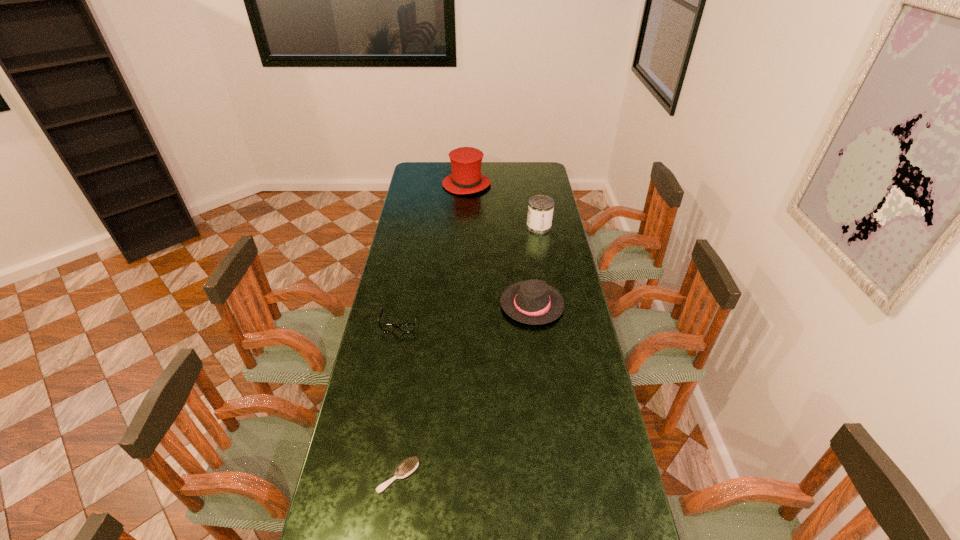
At what (x,y) coordinates should I click in order to perform the action: click on empty location between the nearer dress hat and the fourth nearest object. Please return your answer as a coordinate pair (x, y). Image resolution: width=960 pixels, height=540 pixels. Looking at the image, I should click on (536, 266).

Image resolution: width=960 pixels, height=540 pixels. What are the coordinates of `free space that is in between the shorter dress hat and the second farthest object` in the screenshot? It's located at (x=536, y=266).

Locate an element on the screen. The height and width of the screenshot is (540, 960). blank region between the tallest object and the right dress hat is located at coordinates (499, 245).

The height and width of the screenshot is (540, 960). Identify the location of vacant space in between the fourth tallest object and the shortest object. (399, 399).

The height and width of the screenshot is (540, 960). Identify the location of object that can be found as the second closest to the can. (534, 302).

Identify which object is the nearest to the second shortest object. Please provide its 2D coordinates. Your answer should be formatted as a tuple, i.e. [(x, y)], where the tuple contains the x and y coordinates of a point satisfying the conditions above.

[(534, 302)]

I want to click on vacant space that satisfies the following two spatial constraints: 1. on the front-facing side of the scrubbing brush; 2. on the left side of the sunglasses, so click(x=371, y=476).

Image resolution: width=960 pixels, height=540 pixels. Identify the location of vacant space that satisfies the following two spatial constraints: 1. on the back side of the can; 2. on the right side of the nearest object. (433, 227).

The height and width of the screenshot is (540, 960). Identify the location of blank area in the image that satisfies the following two spatial constraints: 1. on the front side of the can; 2. on the right side of the left dress hat. (465, 227).